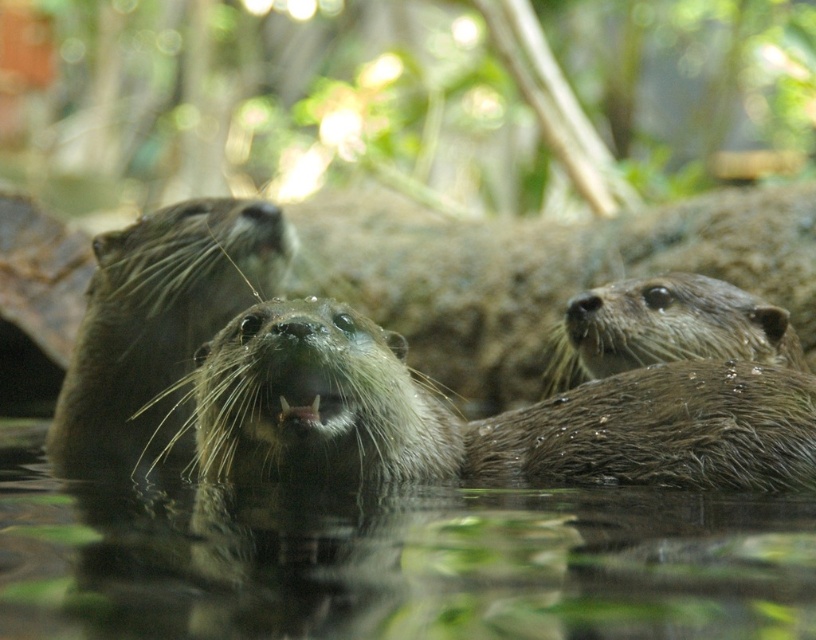
You are an otter in the image and want to swim to the clear water at center. Based on the coordinates provided, which direction should you swim to reach it?

The clear water at center is located at coordinates point [393,563]. Since the otter is in the foreground, it should swim towards the center of the image to reach the clear water at center.

Based on the photo, you are a zookeeper trying to measure the space between the clear water at center and the fuzzy brown otter at center. Which one is wider?

The clear water at center is wider than the fuzzy brown otter at center according to the description.

You are a zookeeper observing the otters in their enclosure. You notice the clear water at center and the fuzzy brown otter at center. Which object occupies a larger area in the image?

The fuzzy brown otter at center occupies a larger area in the image than the clear water at center, as stated in the description.